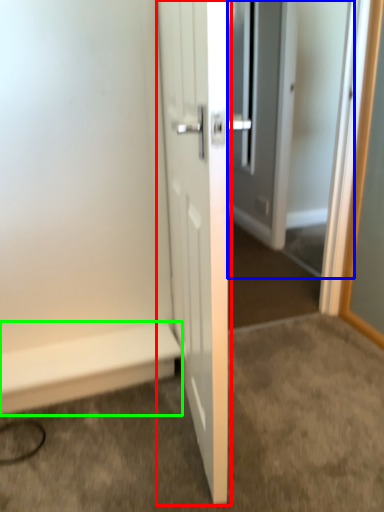
Question: Which object is positioned closest to door (highlighted by a red box)? Select from screen door (highlighted by a blue box) and stairwell (highlighted by a green box).

Choices:
 (A) screen door
 (B) stairwell

Answer: (B)